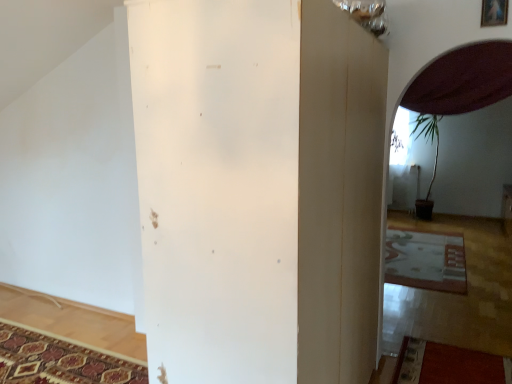
Question: Can you confirm if patterned carpet at lower left, acting as the second mat starting from the right, is smaller than wooden picture frame at upper right?

Choices:
 (A) yes
 (B) no

Answer: (B)

Question: Is patterned carpet at lower left, placed as the 2th mat when sorted from back to front, to the right of wooden picture frame at upper right from the viewer's perspective?

Choices:
 (A) yes
 (B) no

Answer: (B)

Question: Is the position of patterned carpet at lower left, marked as the first mat in a bottom-to-top arrangement, more distant than that of wooden picture frame at upper right?

Choices:
 (A) yes
 (B) no

Answer: (A)

Question: Would you consider patterned carpet at lower left, which is counted as the 2th mat, starting from the top, to be distant from wooden picture frame at upper right?

Choices:
 (A) yes
 (B) no

Answer: (A)

Question: Is patterned carpet at lower left, which ranks as the 1th mat in front-to-back order, aimed at wooden picture frame at upper right?

Choices:
 (A) yes
 (B) no

Answer: (B)

Question: From a real-world perspective, is patterned carpet at lower left, placed as the 2th mat when sorted from back to front, above or below wooden picture frame at upper right?

Choices:
 (A) below
 (B) above

Answer: (A)

Question: Is patterned carpet at lower left, placed as the 2th mat when sorted from back to front, spatially inside wooden picture frame at upper right, or outside of it?

Choices:
 (A) inside
 (B) outside

Answer: (B)

Question: Is point (47, 332) positioned closer to the camera than point (482, 11)?

Choices:
 (A) farther
 (B) closer

Answer: (A)

Question: In terms of height, does patterned carpet at lower left, marked as the first mat in a bottom-to-top arrangement, look taller or shorter compared to wooden picture frame at upper right?

Choices:
 (A) tall
 (B) short

Answer: (B)

Question: Is point (56, 382) positioned closer to the camera than point (242, 92)?

Choices:
 (A) farther
 (B) closer

Answer: (A)

Question: From the image's perspective, relative to white matte pillar at center, is patterned carpet at lower left, which is the 1th mat in left-to-right order, above or below?

Choices:
 (A) above
 (B) below

Answer: (B)

Question: In the image, is patterned carpet at lower left, acting as the second mat starting from the right, on the left side or the right side of white matte pillar at center?

Choices:
 (A) left
 (B) right

Answer: (A)

Question: Considering the positions of patterned carpet at lower left, acting as the second mat starting from the right, and white matte pillar at center in the image, is patterned carpet at lower left, acting as the second mat starting from the right, wider or thinner than white matte pillar at center?

Choices:
 (A) thin
 (B) wide

Answer: (B)

Question: Based on their positions, is white matte pillar at center located to the left or right of patterned carpet at lower left, which is counted as the 2th mat, starting from the top?

Choices:
 (A) left
 (B) right

Answer: (B)

Question: Is white matte pillar at center inside the boundaries of patterned carpet at lower left, marked as the first mat in a bottom-to-top arrangement, or outside?

Choices:
 (A) inside
 (B) outside

Answer: (B)